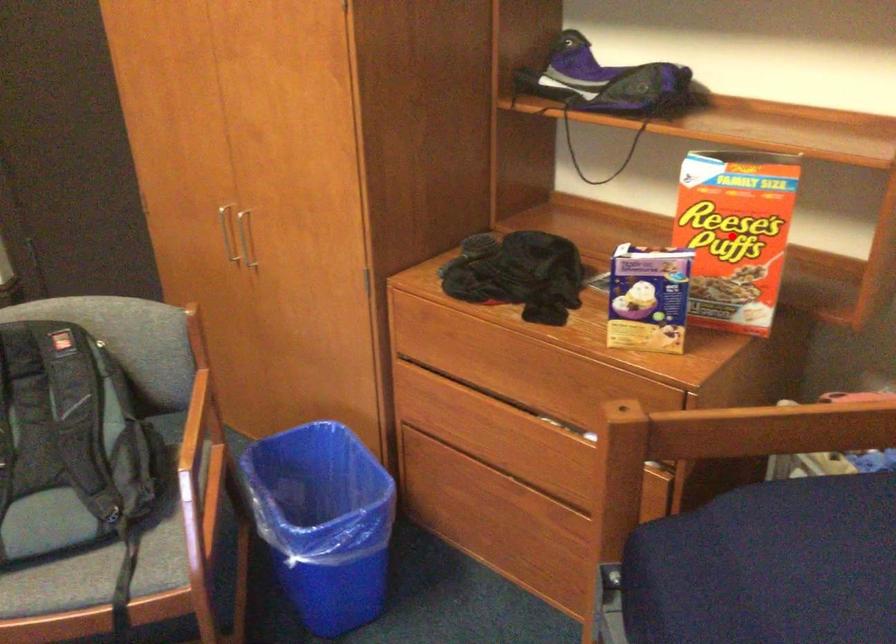
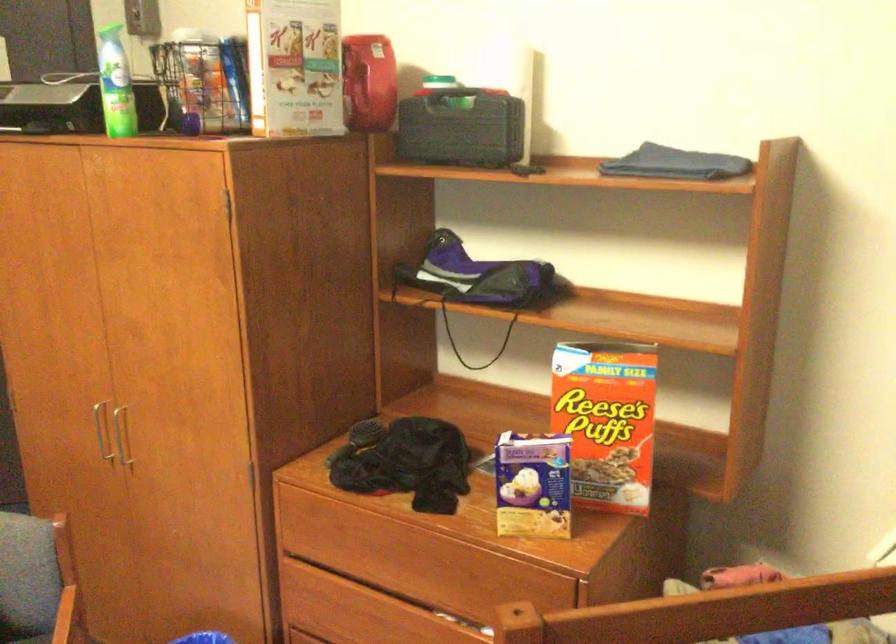
Locate, in the second image, the point that corresponds to the highlighted location in the first image.

(606, 420)